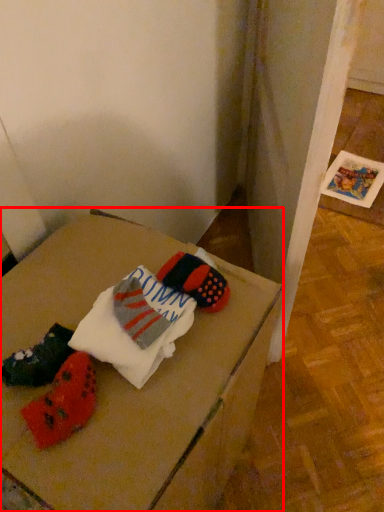
Question: From the image, what is the correct spatial relationship of furniture (annotated by the red box) in relation to sheet?

Choices:
 (A) left
 (B) right

Answer: (A)